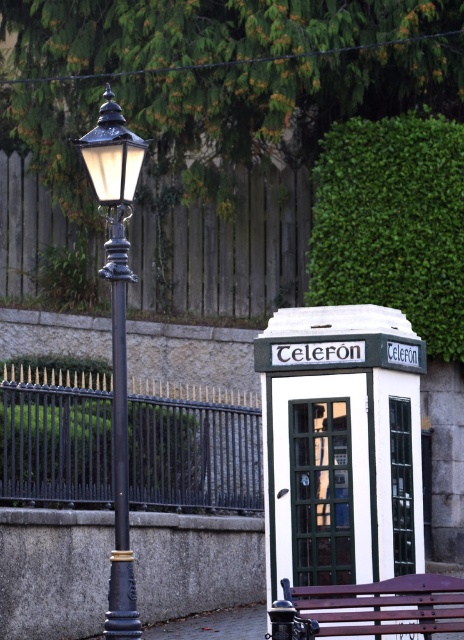
You are standing at the point marked by the coordinate point at point (116, 332). Looking towards the telephone booth, which direction should you walk to reach it?

The telephone booth is to the right of the matte black lamp post at left, so you should walk to the right to reach it.

You are standing in front of the telephone booth and the lamppost in the urban scene. You notice two points marked in the image. The first point is at coordinate point (103, 120) and the second is at coordinate point (381, 612). Which point is closer to you?

Point (103, 120) is further to the camera than point (381, 612), so the point closer to you is point (381, 612).

You are standing in the middle of the street and see the white painted metal telephone booth at center and the matte black lamp at left. Which object is closer to you?

The white painted metal telephone booth at center is closer to you because it is further to the viewer than the matte black lamp at left.